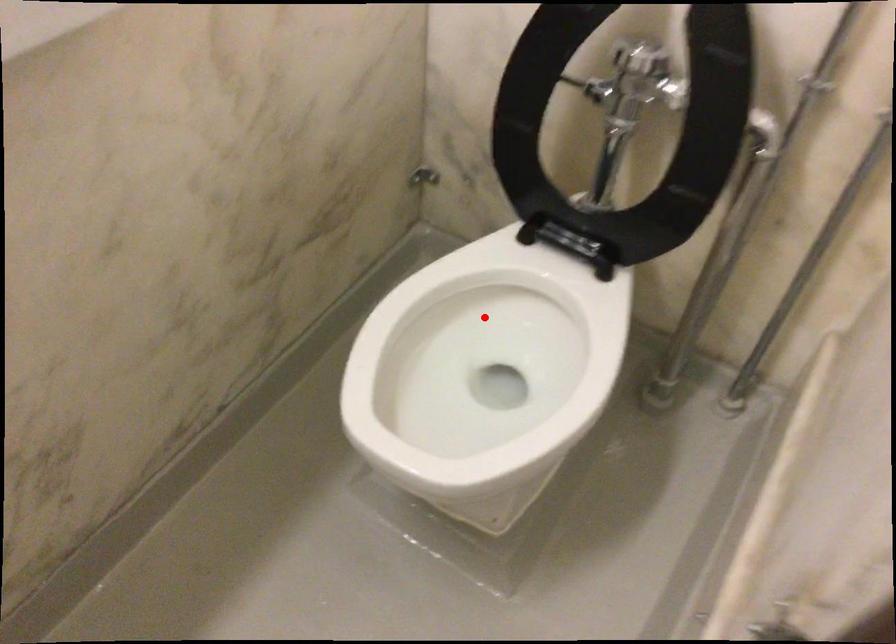
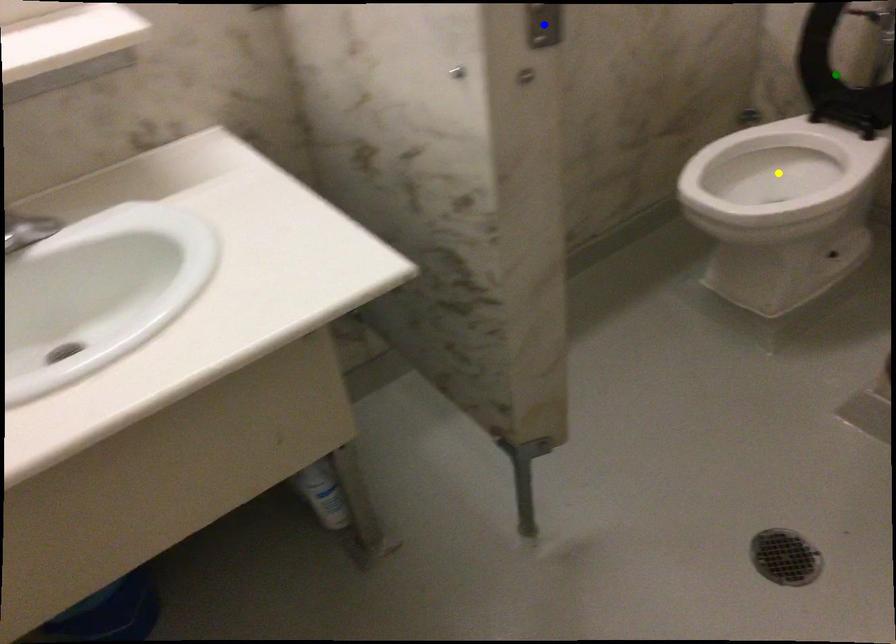
Question: I am providing you with two images of the same scene from different viewpoints. A red point is marked on the first image. You are given multiple points on the second image. Which mark in image 2 goes with the point in image 1?

Choices:
 (A) green point
 (B) yellow point
 (C) blue point

Answer: (B)